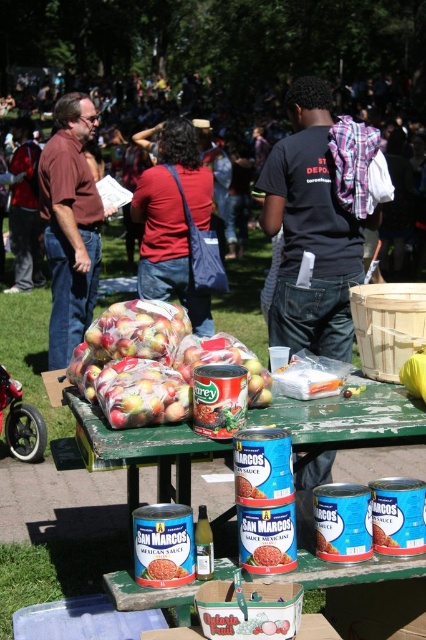
You are at a community event and see the shiny plastic apples at center and the matte brown shirt at left. Which object is closer to the ground?

The shiny plastic apples at center is located below matte brown shirt at left, so it is closer to the ground than the matte brown shirt at left.

You are standing at the entrance of the park and see the blue plastic table at center and the brown shirt at left. Which object is closer to you?

The blue plastic table at center is closer to you because it is in front of the brown shirt at left.